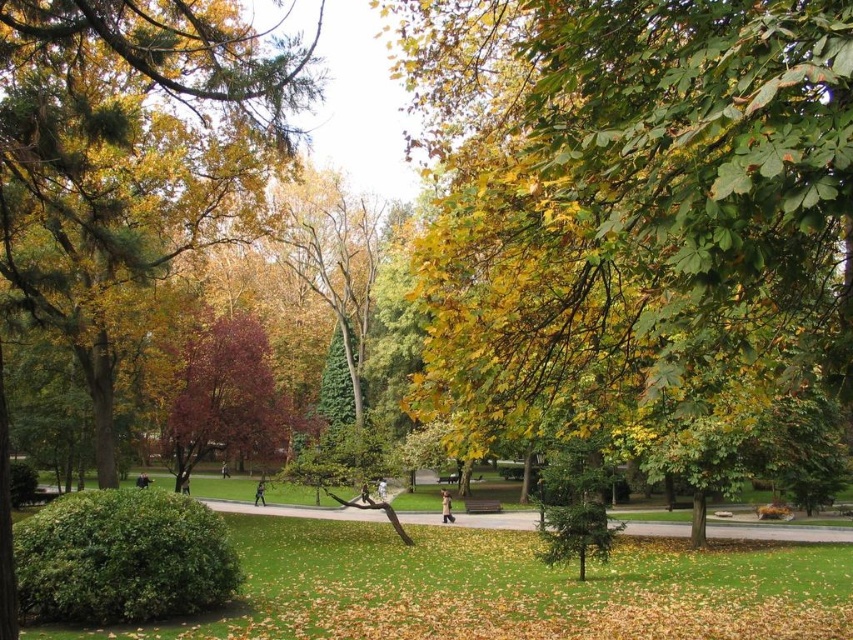
You are a park visitor trying to decide which tree to sit under for a picnic. The green glossy tree at upper left and the purple glossy tree at center are both options. Based on their widths, which tree would provide more shade coverage?

The green glossy tree at upper left might be wider than purple glossy tree at center, so it could provide more shade coverage if its width indeed exceeds the purple one.

You are a park visitor standing at the entrance of the pathway. You see the green glossy tree at upper left and the purple glossy tree at center. Which tree is positioned higher in the image?

The green glossy tree at upper left is located above the purple glossy tree at center in the image.

You are standing at the center of the park and want to locate the green glossy tree at upper left. Based on the coordinates provided, in which cardinal direction should you look to find it?

The green glossy tree at upper left is located at coordinates point (132,154), which corresponds to the upper left direction from your current position at the center of the park.